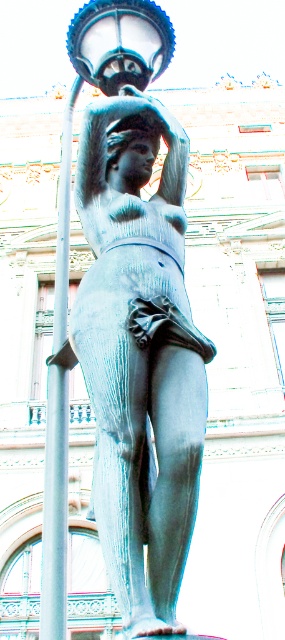
Which is in front, point (174, 464) or point (62, 500)?

Positioned in front is point (174, 464).

Who is positioned more to the left, bronze statue at center or silver metallic pole at left?

Positioned to the left is silver metallic pole at left.

Which is behind, point (135, 312) or point (55, 291)?

Positioned behind is point (55, 291).

I want to click on bronze statue at center, so click(139, 353).

Locate an element on the screen. bronze statue at center is located at coordinates (139, 353).

Is bronze statue at center closer to the viewer compared to matte glass lamp at upper center?

Yes, bronze statue at center is closer to the viewer.

Is point (182, 172) farther from camera compared to point (149, 54)?

No, it is not.

The height and width of the screenshot is (640, 285). Find the location of `bronze statue at center`. bronze statue at center is located at coordinates (139, 353).

Which is more to the right, silver metallic pole at left or matte glass lamp at upper center?

Positioned to the right is matte glass lamp at upper center.

Which is below, silver metallic pole at left or matte glass lamp at upper center?

silver metallic pole at left

Who is more forward, (58, 205) or (131, 51)?

Point (131, 51)

At what (x,y) coordinates should I click in order to perform the action: click on silver metallic pole at left. Please return your answer as a coordinate pair (x, y). Image resolution: width=285 pixels, height=640 pixels. Looking at the image, I should click on (58, 413).